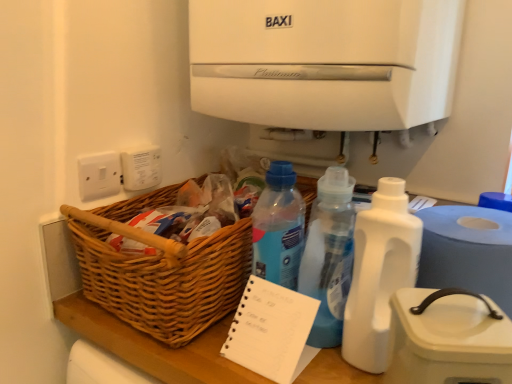
Question: Considering the relative positions of white spiral-bound notepad at center and woven wood basket at lower left in the image provided, is white spiral-bound notepad at center in front of woven wood basket at lower left?

Choices:
 (A) yes
 (B) no

Answer: (A)

Question: Is woven wood basket at lower left located within white spiral-bound notepad at center?

Choices:
 (A) yes
 (B) no

Answer: (B)

Question: From a real-world perspective, is white spiral-bound notepad at center on woven wood basket at lower left?

Choices:
 (A) no
 (B) yes

Answer: (A)

Question: Can you see white spiral-bound notepad at center touching woven wood basket at lower left?

Choices:
 (A) yes
 (B) no

Answer: (B)

Question: Can we say white spiral-bound notepad at center lies outside woven wood basket at lower left?

Choices:
 (A) yes
 (B) no

Answer: (A)

Question: Based on their sizes in the image, would you say white plastic paper towel at lower right is bigger or smaller than white plastic bottle at center-right, placed as the 2th bottle when sorted from left to right?

Choices:
 (A) small
 (B) big

Answer: (B)

Question: Do you think white plastic paper towel at lower right is within white plastic bottle at center-right, placed as the 2th bottle when sorted from left to right, or outside of it?

Choices:
 (A) outside
 (B) inside

Answer: (A)

Question: In terms of height, does white plastic paper towel at lower right look taller or shorter compared to white plastic bottle at center-right, placed as the 2th bottle when sorted from left to right?

Choices:
 (A) tall
 (B) short

Answer: (B)

Question: In the image, is white plastic paper towel at lower right positioned in front of or behind white plastic bottle at center-right, arranged as the 1th bottle when viewed from the right?

Choices:
 (A) front
 (B) behind

Answer: (B)

Question: Is white spiral-bound notepad at center wider or thinner than white matte water cooler at upper center?

Choices:
 (A) wide
 (B) thin

Answer: (B)

Question: Considering the relative positions of white spiral-bound notepad at center and white matte water cooler at upper center in the image provided, is white spiral-bound notepad at center to the left or to the right of white matte water cooler at upper center?

Choices:
 (A) right
 (B) left

Answer: (B)

Question: Is white spiral-bound notepad at center inside or outside of white matte water cooler at upper center?

Choices:
 (A) inside
 (B) outside

Answer: (B)

Question: From the image's perspective, is white spiral-bound notepad at center located above or below white matte water cooler at upper center?

Choices:
 (A) below
 (B) above

Answer: (A)

Question: Is point tap(382, 321) positioned closer to the camera than point tap(488, 379)?

Choices:
 (A) closer
 (B) farther

Answer: (B)

Question: Considering the positions of white plastic bottle at center-right, arranged as the 1th bottle when viewed from the right, and white plastic container at right in the image, is white plastic bottle at center-right, arranged as the 1th bottle when viewed from the right, taller or shorter than white plastic container at right?

Choices:
 (A) tall
 (B) short

Answer: (A)